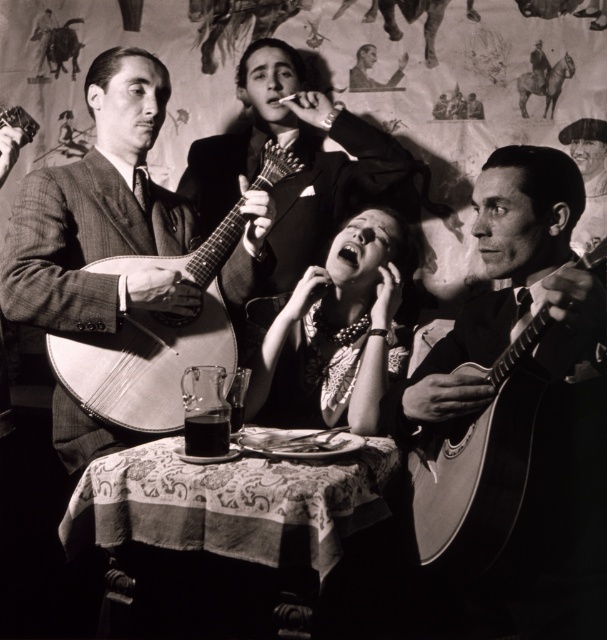
Question: Does matte black necklace at center come behind shiny wood mandolin at right?

Choices:
 (A) no
 (B) yes

Answer: (B)

Question: Does shiny wood mandolin at right have a lesser width compared to matte wooden guitar at left?

Choices:
 (A) no
 (B) yes

Answer: (B)

Question: Does matte black necklace at center have a smaller size compared to shiny wood mandolin at right?

Choices:
 (A) yes
 (B) no

Answer: (B)

Question: Which of the following is the farthest from the observer?

Choices:
 (A) matte wooden guitar at left
 (B) matte black necklace at center

Answer: (B)

Question: Which object is closer to the camera taking this photo?

Choices:
 (A) matte black necklace at center
 (B) matte wooden guitar at left
 (C) shiny wood mandolin at right

Answer: (C)

Question: Estimate the real-world distances between objects in this image. Which object is farther from the matte black necklace at center?

Choices:
 (A) matte wooden guitar at left
 (B) shiny wood mandolin at right

Answer: (B)